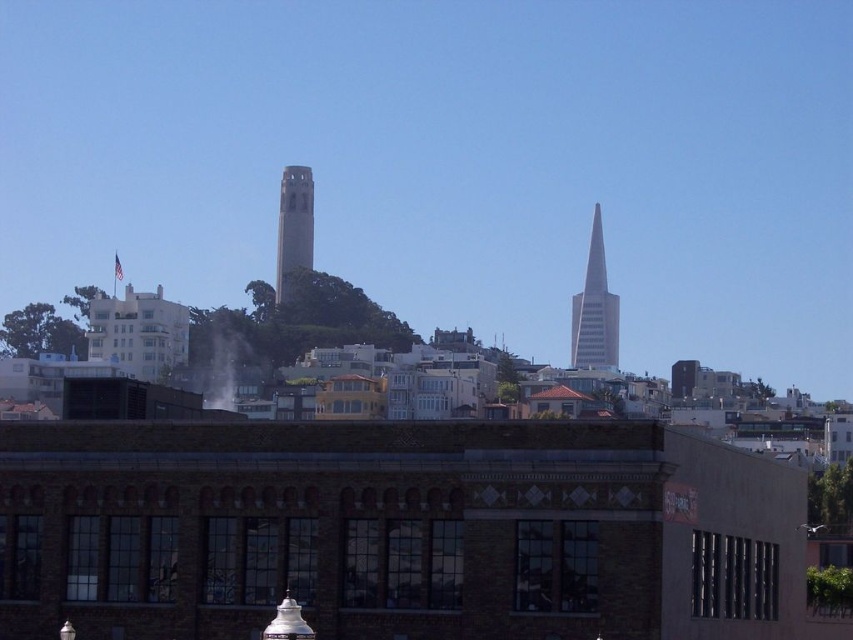
You are an urban planner assessing the skyline. The city wants to install a new antenna on the taller structure between the silver glass spire at center right and the concrete tower at center. Which building should the antenna be placed on?

The silver glass spire at center right is larger in size than the concrete tower at center, so the antenna should be placed on the silver glass spire at center right since it is the taller structure.

Based on the photo, you are standing in the city square and want to take a photo of the silver glass spire at center right and the concrete tower at center. Which one should you frame first in your camera to ensure both are in the shot?

You should frame the concrete tower at center first because the silver glass spire at center right is to the right of it, so positioning the camera to include both requires starting with the leftmost object.